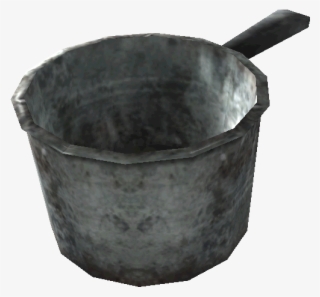
Identify the location of points on the cup bottom. This screenshot has width=320, height=297. (61, 253), (93, 277), (140, 286), (188, 281), (226, 260), (247, 230).